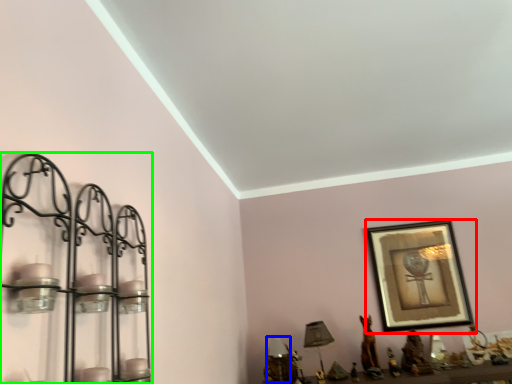
Question: Which is farther away from picture frame (highlighted by a red box)? table lamp (highlighted by a blue box) or shelf (highlighted by a green box)?

Choices:
 (A) table lamp
 (B) shelf

Answer: (B)